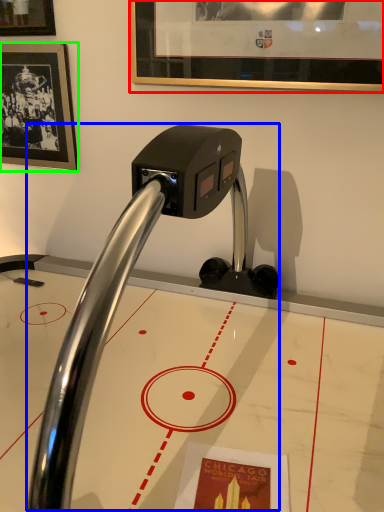
Question: Estimate the real-world distances between objects in this image. Which object is closer to picture frame (highlighted by a red box), faucet (highlighted by a blue box) or picture frame (highlighted by a green box)?

Choices:
 (A) faucet
 (B) picture frame

Answer: (B)